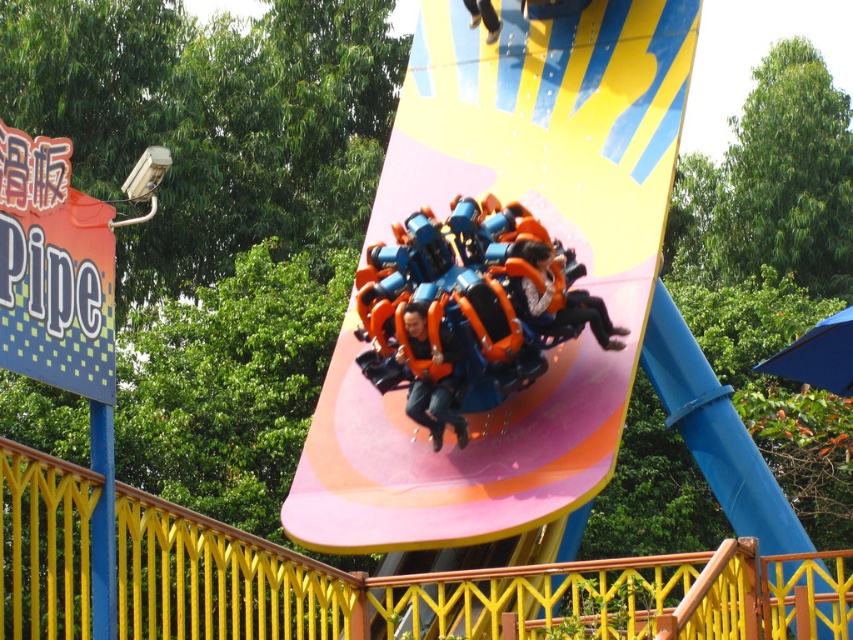
From the picture: You are a safety inspector checking the amusement park ride. You notice two items at the center of the ride, the orange fabric seat at center and the matte orange helmet at center. Which item is smaller in size?

The orange fabric seat at center is smaller in size compared to the matte orange helmet at center.

You are designing a new ride for the amusement park and need to ensure safety. The orange matte roller coaster car at center must fit through a tunnel that is exactly the width of the orange fabric seat at center. Will the car fit through the tunnel?

The orange matte roller coaster car at center is wider than the orange fabric seat at center, so it will not fit through a tunnel that is exactly the width of the orange fabric seat at center.

You are standing at the entrance of the amusement park and see the orange matte slide at center and the matte orange helmet at center. If you want to reach both attractions, which one would you need to walk farther to get to?

The orange matte slide at center is 39.45 feet away from the matte orange helmet at center, so whichever one you visit first, the other will require walking an additional 39.45 feet. However, since both are at the same center location according to their labels, their distance apart might be part of the same attraction complex, so you might not need to walk far between them. Please check the park map for exact paths.